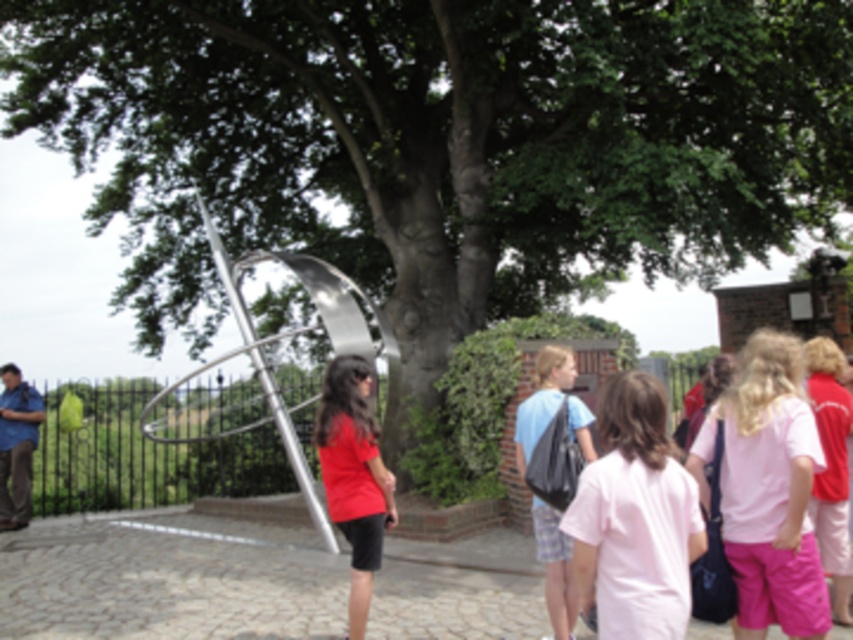
Can you confirm if pink cotton shirt at center is shorter than shiny metallic sculpture at center?

In fact, pink cotton shirt at center may be taller than shiny metallic sculpture at center.

Does pink cotton shirt at center have a greater width compared to shiny metallic sculpture at center?

Indeed, pink cotton shirt at center has a greater width compared to shiny metallic sculpture at center.

Is point (585, 508) less distant than point (277, 403)?

Yes, point (585, 508) is closer to viewer.

Image resolution: width=853 pixels, height=640 pixels. I want to click on pink cotton shirt at center, so click(x=635, y=516).

Does shiny metallic sculpture at center lie behind matte red shirt at center?

Yes, it is.

Is shiny metallic sculpture at center shorter than matte red shirt at center?

Correct, shiny metallic sculpture at center is not as tall as matte red shirt at center.

What do you see at coordinates (264, 356) in the screenshot? I see `shiny metallic sculpture at center` at bounding box center [264, 356].

Locate an element on the screen. Image resolution: width=853 pixels, height=640 pixels. shiny metallic sculpture at center is located at coordinates (264, 356).

In the scene shown: Which is below, pink cotton shirt at center or matte red shirt at center?

Positioned lower is matte red shirt at center.

Looking at this image, can you confirm if pink cotton shirt at center is smaller than matte red shirt at center?

Indeed, pink cotton shirt at center has a smaller size compared to matte red shirt at center.

This screenshot has width=853, height=640. Describe the element at coordinates (635, 516) in the screenshot. I see `pink cotton shirt at center` at that location.

At what (x,y) coordinates should I click in order to perform the action: click on pink cotton shirt at center. Please return your answer as a coordinate pair (x, y). Image resolution: width=853 pixels, height=640 pixels. Looking at the image, I should click on (635, 516).